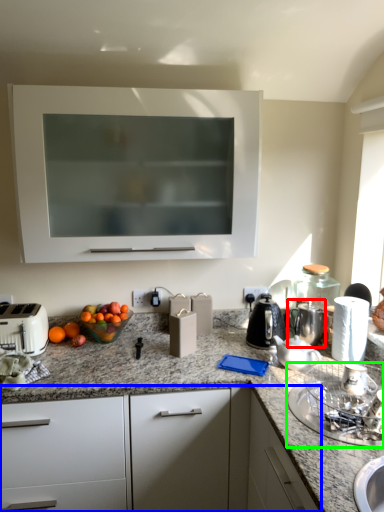
Question: Which object is the farthest from coffeepot (highlighted by a red box)? Choose among these: cabinetry (highlighted by a blue box) or appliance (highlighted by a green box).

Choices:
 (A) cabinetry
 (B) appliance

Answer: (A)